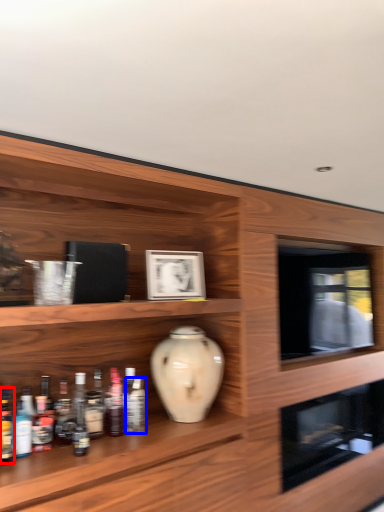
Question: Which of the following is the closest to the observer, bottle (highlighted by a red box) or bottle (highlighted by a blue box)?

Choices:
 (A) bottle
 (B) bottle

Answer: (A)